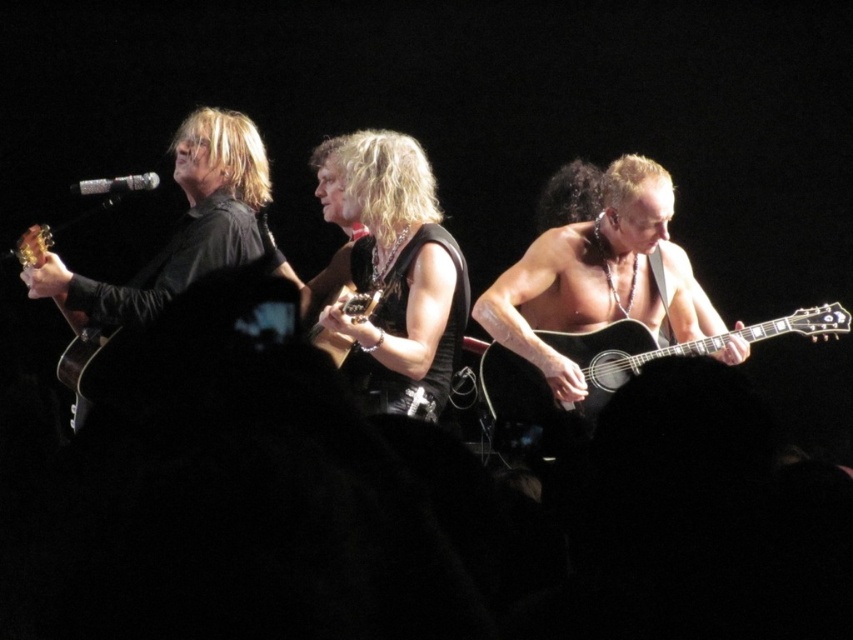
Question: Does matte black guitar at left appear over silver metallic microphone at upper center?

Choices:
 (A) no
 (B) yes

Answer: (A)

Question: Among these points, which one is farthest from the camera?

Choices:
 (A) (354, 332)
 (B) (41, 227)

Answer: (A)

Question: Which object is closer to the camera taking this photo?

Choices:
 (A) silver metallic microphone at upper center
 (B) acoustic wood guitar at right
 (C) black leather vest at center
 (D) matte black guitar at left

Answer: (D)

Question: Is acoustic wood guitar at right bigger than matte black guitar at center?

Choices:
 (A) no
 (B) yes

Answer: (B)

Question: Among these objects, which one is nearest to the camera?

Choices:
 (A) acoustic wood guitar at right
 (B) matte black guitar at center
 (C) silver metallic microphone at upper center
 (D) matte black guitar at left

Answer: (D)

Question: Observing the image, what is the correct spatial positioning of acoustic wood guitar at right in reference to matte black guitar at left?

Choices:
 (A) above
 (B) below

Answer: (B)